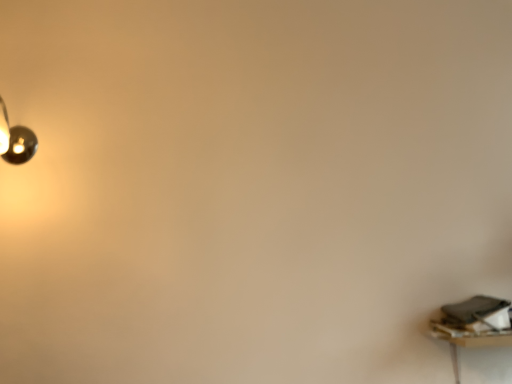
At what (x,y) coordinates should I click in order to perform the action: click on wooden table at lower right. Please return your answer as a coordinate pair (x, y). The width and height of the screenshot is (512, 384). Looking at the image, I should click on (467, 339).

The image size is (512, 384). Describe the element at coordinates (467, 339) in the screenshot. I see `wooden table at lower right` at that location.

Identify the location of wooden table at lower right. (467, 339).